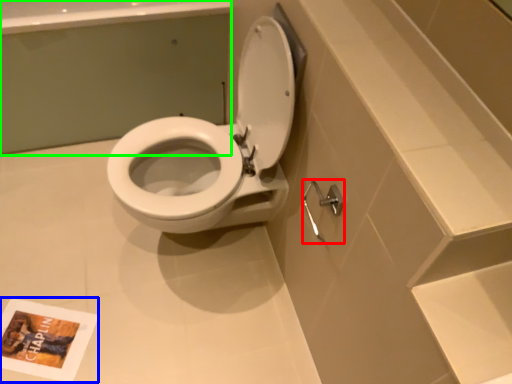
Question: Which object is the closest to the shower (highlighted by a red box)? Choose among these: book cover (highlighted by a blue box) or bath (highlighted by a green box).

Choices:
 (A) book cover
 (B) bath

Answer: (A)